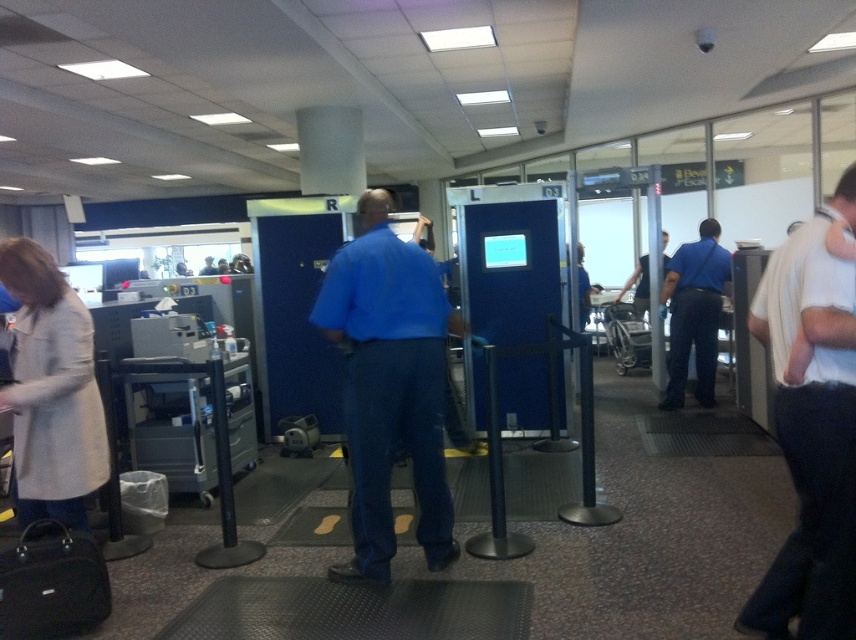
Question: Among these objects, which one is farthest from the camera?

Choices:
 (A) black leather suitcase at lower left
 (B) blue cotton shirt at center
 (C) light beige coat at left

Answer: (B)

Question: Based on their relative distances, which object is farther from the blue uniform at center?

Choices:
 (A) white cotton shirt at right
 (B) light beige coat at left
 (C) blue cotton shirt at center
 (D) black leather suitcase at lower left

Answer: (D)

Question: Based on their relative distances, which object is farther from the light beige coat at left?

Choices:
 (A) white cotton shirt at right
 (B) blue cotton shirt at center

Answer: (A)

Question: In this image, where is blue cotton shirt at center located relative to blue uniform at center?

Choices:
 (A) above
 (B) below

Answer: (B)

Question: Observing the image, what is the correct spatial positioning of white cotton shirt at right in reference to blue cotton shirt at center?

Choices:
 (A) right
 (B) left

Answer: (A)

Question: Is black leather suitcase at lower left to the left of blue uniform at center from the viewer's perspective?

Choices:
 (A) no
 (B) yes

Answer: (B)